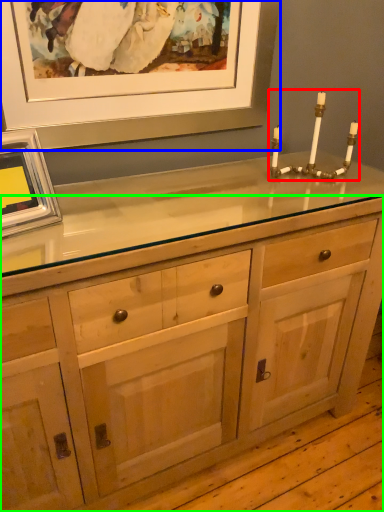
Question: Based on their relative distances, which object is farther from candle holder (highlighted by a red box)? Choose from picture frame (highlighted by a blue box) and chest of drawers (highlighted by a green box).

Choices:
 (A) picture frame
 (B) chest of drawers

Answer: (B)